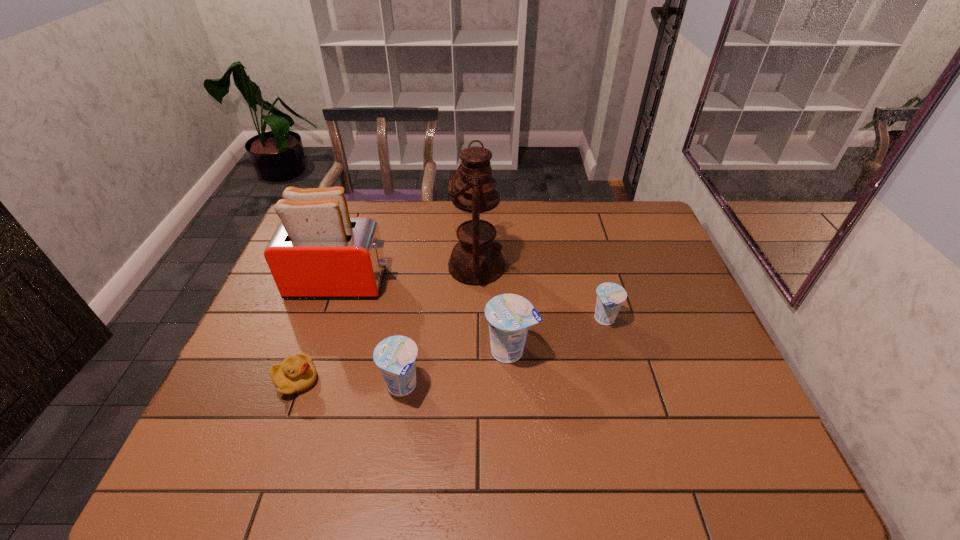
Where is `vacant area that lies between the toaster and the duckling`? vacant area that lies between the toaster and the duckling is located at coordinates (318, 332).

You are a GUI agent. You are given a task and a screenshot of the screen. Output one action in this format:
    pyautogui.click(x=<x>, y=<y>)
    Task: Click on the vacant point located between the toaster and the rightmost yogurt
    
    Given the screenshot: What is the action you would take?
    pyautogui.click(x=472, y=301)

Locate an element on the screen. Image resolution: width=960 pixels, height=540 pixels. free space between the farthest yogurt and the toaster is located at coordinates (472, 301).

Where is `vacant region between the second yogurt from right to left and the third object from left to right`? This screenshot has width=960, height=540. vacant region between the second yogurt from right to left and the third object from left to right is located at coordinates point(456,369).

Find the location of a particular element. object that is the fifth closest to the oil lamp is located at coordinates (295, 374).

Image resolution: width=960 pixels, height=540 pixels. Identify the location of the third closest object to the fifth shortest object. (396, 356).

Identify which yogurt is located as the second nearest to the tallest yogurt. Please provide its 2D coordinates. Your answer should be formatted as a tuple, i.e. [(x, y)], where the tuple contains the x and y coordinates of a point satisfying the conditions above.

[(610, 296)]

Locate an element on the screen. This screenshot has height=540, width=960. yogurt that is the second closest one to the shortest object is located at coordinates (509, 316).

Where is `vacant space that satisfies the following two spatial constraints: 1. on the back side of the third farthest object; 2. on the front-facing side of the fifth shortest object`? vacant space that satisfies the following two spatial constraints: 1. on the back side of the third farthest object; 2. on the front-facing side of the fifth shortest object is located at coordinates (595, 283).

This screenshot has height=540, width=960. I want to click on free location that satisfies the following two spatial constraints: 1. on the back side of the fourth object from right to left; 2. on the front-facing side of the duckling, so click(402, 381).